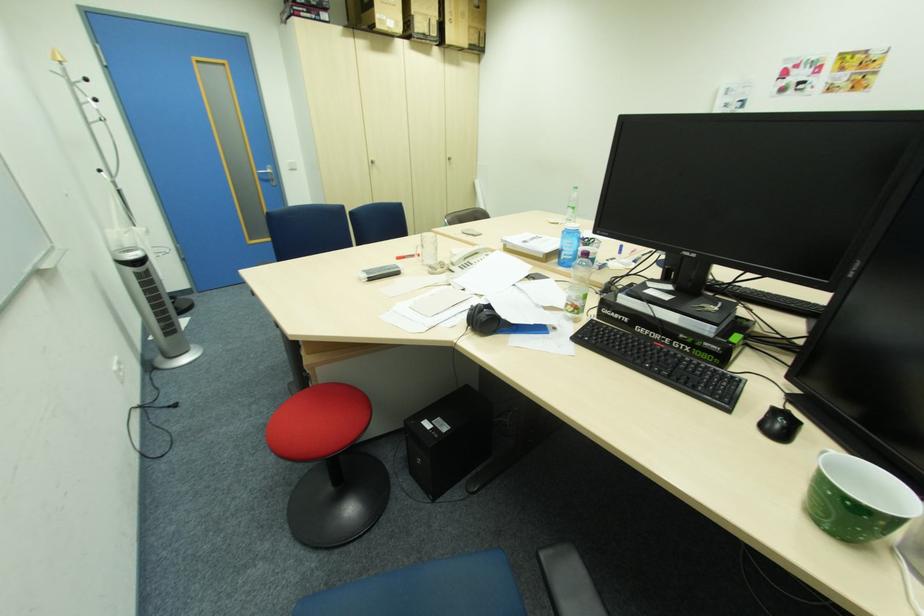
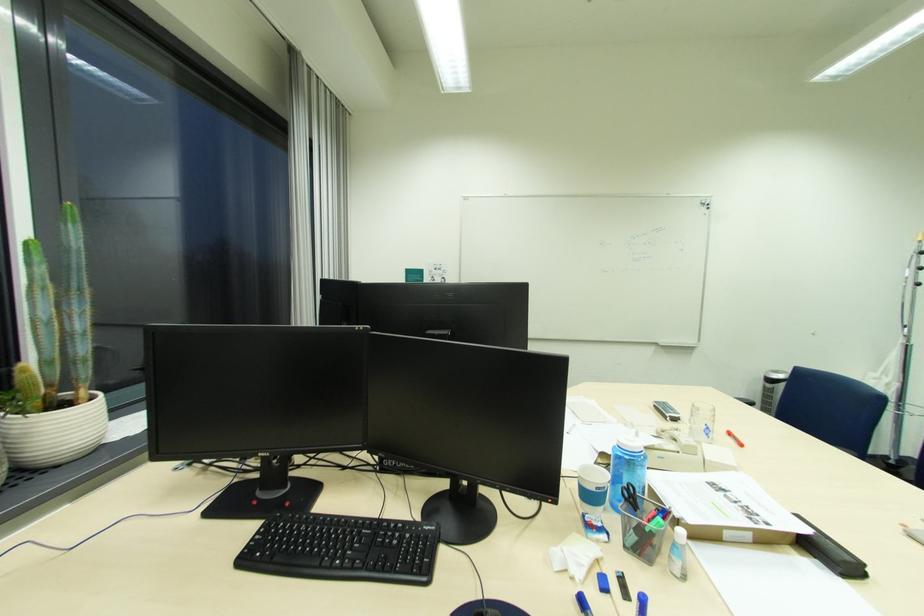
Where in the second image is the point corresponding to point (405, 259) from the first image?

(736, 435)